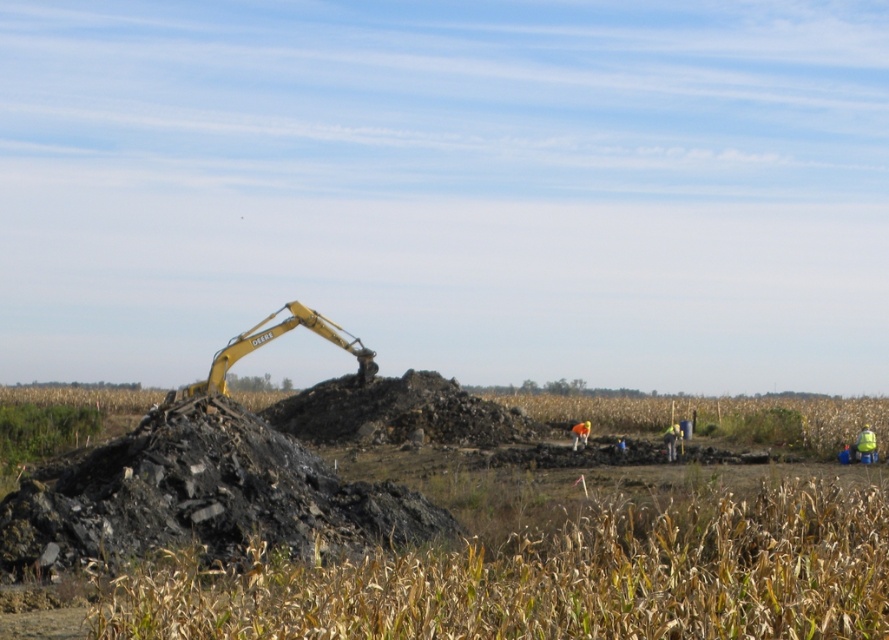
Question: Among these objects, which one is nearest to the camera?

Choices:
 (A) green reflective safety vest at lower right
 (B) yellow hard hat at center
 (C) orange fabric at center

Answer: (B)

Question: Among these objects, which one is farthest from the camera?

Choices:
 (A) yellow metallic excavator at center
 (B) orange fabric at center
 (C) brown grass at lower center
 (D) green reflective safety vest at lower right

Answer: (B)

Question: Does yellow metallic excavator at center appear over orange fabric at center?

Choices:
 (A) no
 (B) yes

Answer: (B)

Question: Does green reflective safety vest at lower right come in front of yellow hard hat at center?

Choices:
 (A) yes
 (B) no

Answer: (B)

Question: Among these points, which one is farthest from the camera?

Choices:
 (A) (589, 426)
 (B) (335, 340)
 (C) (869, 435)
 (D) (437, 608)

Answer: (A)

Question: Can you confirm if brown grass at lower center is smaller than green reflective safety vest at lower right?

Choices:
 (A) yes
 (B) no

Answer: (A)